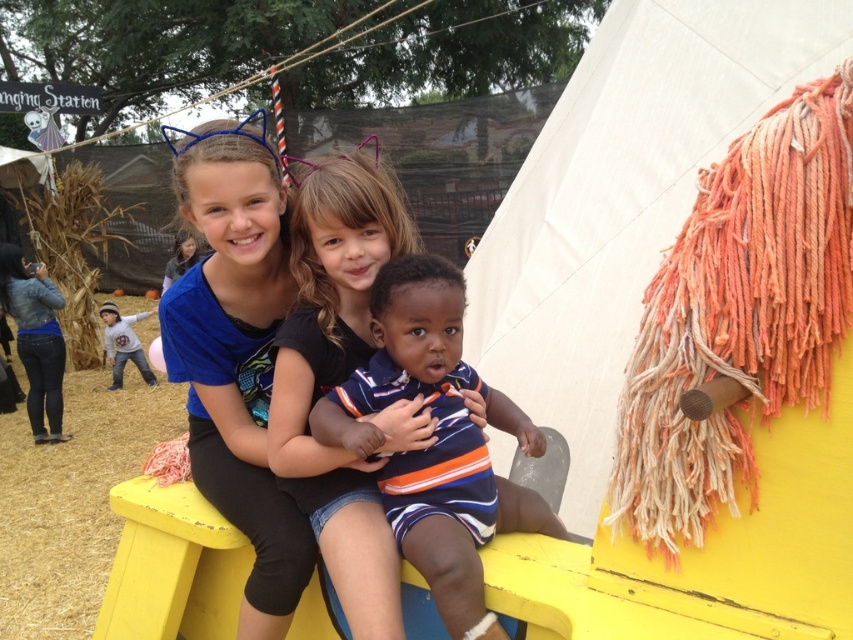
Based on the photo, you are a photographer at the event and want to capture a closeup of the blue fabric headband at upper center and the striped cotton shirt at center. Since you can only focus on one object at a time, which object should you choose to ensure the other remains in the background without being too blurry?

The blue fabric headband at upper center has a lesser width compared to striped cotton shirt at center. Therefore, focusing on the striped cotton shirt at center would keep the smaller headband in the background with acceptable sharpness, as wider objects generally require more depth of field to stay in focus.

Based on the photo, you are organizing a costume party and need to ensure that all accessories fit properly. You have a blue fabric headband at upper center and a matte black shirt at center. Which accessory has a greater width?

The blue fabric headband at upper center has a greater width than the matte black shirt at center according to the description.

You are a photographer at the event and want to capture a photo of the blue fabric headband at upper center. The camera is currently pointed at the point marked by coordinates point (236, 353). Is the camera already aimed at the correct location to capture the blue fabric headband at upper center?

The blue fabric headband at upper center is represented by the point (236, 353), so the camera is already aimed at the correct location to capture the blue fabric headband at upper center.